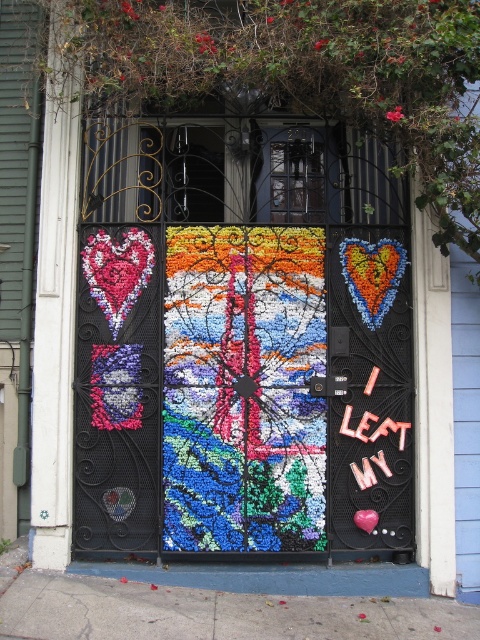
Is point (244, 500) more distant than point (400, 435)?

No.

Who is positioned more to the left, multicolored mosaic door at center or pink plastic letters at center right?

Positioned to the left is multicolored mosaic door at center.

Between point (156, 426) and point (394, 426), which one is positioned in front?

Positioned in front is point (156, 426).

I want to click on multicolored mosaic door at center, so click(245, 353).

Measure the distance between multicolored mosaic door at center and pink matte heart at center.

A distance of 4.19 feet exists between multicolored mosaic door at center and pink matte heart at center.

Which of these two, multicolored mosaic door at center or pink matte heart at center, stands taller?

With more height is multicolored mosaic door at center.

Which is behind, point (141, 227) or point (365, 509)?

Positioned behind is point (141, 227).

Identify the location of multicolored mosaic door at center. (245, 353).

Between point (369, 380) and point (370, 522), which one is positioned behind?

Positioned behind is point (369, 380).

Can you confirm if pink plastic letters at center right is wider than pink matte heart at center?

Correct, the width of pink plastic letters at center right exceeds that of pink matte heart at center.

What do you see at coordinates (373, 428) in the screenshot? I see `pink plastic letters at center right` at bounding box center [373, 428].

The height and width of the screenshot is (640, 480). Identify the location of pink plastic letters at center right. (373, 428).